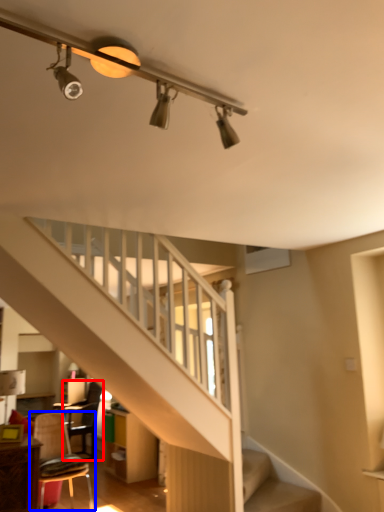
Question: Which point is closer to the camera, chair (highlighted by a red box) or chair (highlighted by a blue box)?

Choices:
 (A) chair
 (B) chair

Answer: (B)